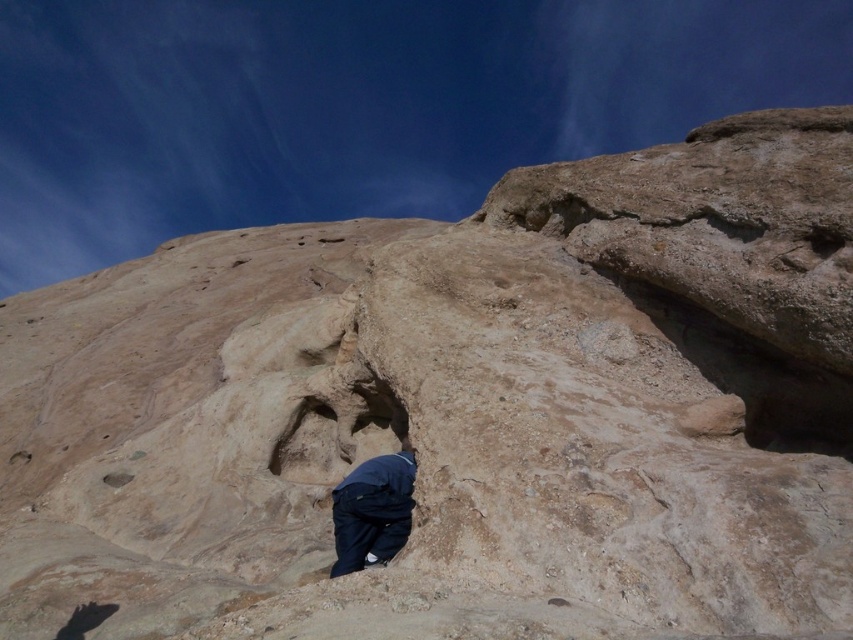
Question: Is smooth sandstone hole at upper right thinner than brown rough hole at lower left?

Choices:
 (A) no
 (B) yes

Answer: (B)

Question: Among these points, which one is nearest to the camera?

Choices:
 (A) (335, 508)
 (B) (811, 230)

Answer: (B)

Question: In this image, where is dark blue fabric at lower center located relative to smooth sandstone hole at upper right?

Choices:
 (A) above
 (B) below

Answer: (B)

Question: Which of the following is the closest to the observer?

Choices:
 (A) smooth sandstone hole at upper right
 (B) dark blue fabric at lower center
 (C) brown rough hole at lower left

Answer: (A)

Question: Estimate the real-world distances between objects in this image. Which object is farther from the brown rough hole at lower left?

Choices:
 (A) dark blue fabric at lower center
 (B) smooth sandstone hole at upper right

Answer: (B)

Question: Does smooth sandstone hole at upper right appear over brown rough hole at lower left?

Choices:
 (A) yes
 (B) no

Answer: (A)